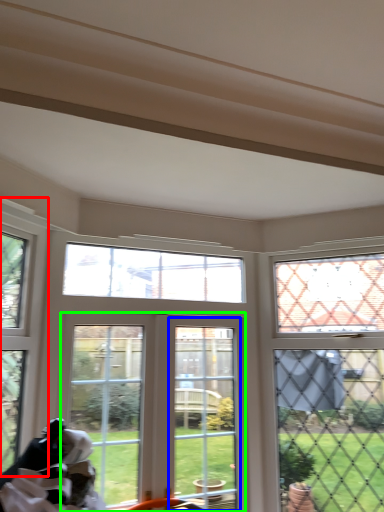
Question: Which object is the closest to the window (highlighted by a red box)? Choose among these: window frame (highlighted by a blue box) or window (highlighted by a green box).

Choices:
 (A) window frame
 (B) window

Answer: (B)